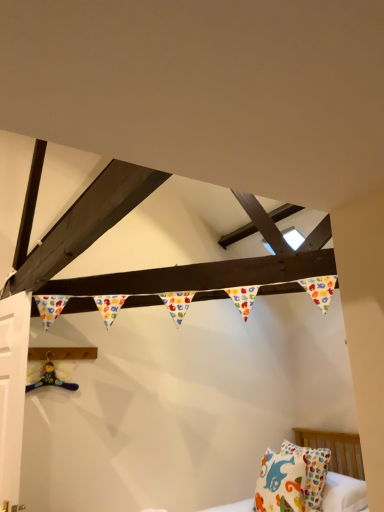
Question: Is multicolored plush toy at lower left wider or thinner than white cotton pillow with colorful patterns at lower right?

Choices:
 (A) thin
 (B) wide

Answer: (A)

Question: Is multicolored plush toy at lower left taller or shorter than white cotton pillow with colorful patterns at lower right?

Choices:
 (A) short
 (B) tall

Answer: (A)

Question: Which object is the closest to the white cotton pillow with colorful patterns at lower right?

Choices:
 (A) white matte door at left
 (B) multicolored plush toy at lower left

Answer: (B)

Question: Which is farther from the white matte door at left?

Choices:
 (A) white cotton pillow with colorful patterns at lower right
 (B) multicolored plush toy at lower left

Answer: (A)